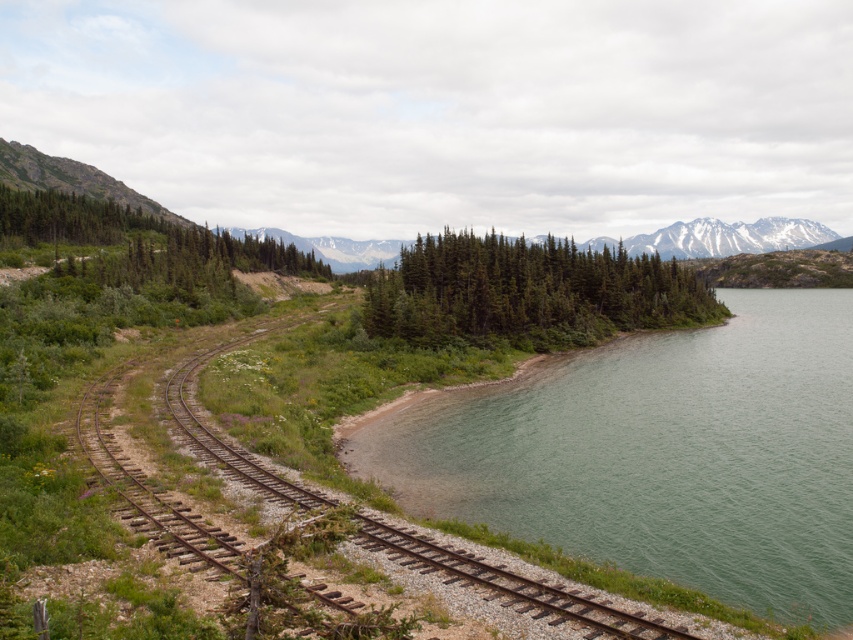
Does green smooth water at center right come in front of brown metal track at left?

No, green smooth water at center right is further to the viewer.

Who is taller, green smooth water at center right or brown metal track at left?

With more height is brown metal track at left.

Image resolution: width=853 pixels, height=640 pixels. I want to click on green smooth water at center right, so click(x=660, y=452).

Where is `green smooth water at center right`? The height and width of the screenshot is (640, 853). green smooth water at center right is located at coordinates (660, 452).

Who is more distant from viewer, (x=476, y=403) or (x=685, y=273)?

Point (x=685, y=273)

Does green smooth water at center right appear under green textured trees at center?

Correct, green smooth water at center right is located below green textured trees at center.

Between point (839, 458) and point (427, 339), which one is positioned in front?

Point (839, 458) is more forward.

Image resolution: width=853 pixels, height=640 pixels. In order to click on green smooth water at center right in this screenshot , I will do `click(660, 452)`.

Is green textured trees at center below brown metal track at left?

No.

Is green textured trees at center smaller than brown metal track at left?

Actually, green textured trees at center might be larger than brown metal track at left.

Does point (514, 269) come farther from viewer compared to point (546, 612)?

Yes, it is behind point (546, 612).

Where is `green textured trees at center`? green textured trees at center is located at coordinates (527, 292).